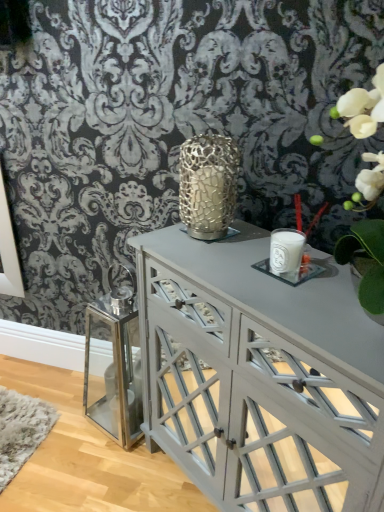
Locate an element on the screen. This screenshot has height=512, width=384. free space to the right of white glass candle at center, marked as the 2th candle holder in a top-to-bottom arrangement is located at coordinates (329, 278).